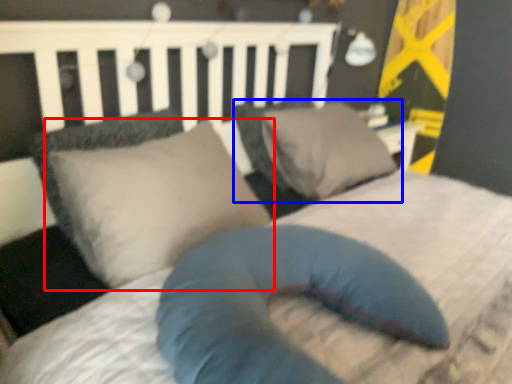
Question: Which of the following is the closest to the observer, pillow (highlighted by a red box) or pillow (highlighted by a blue box)?

Choices:
 (A) pillow
 (B) pillow

Answer: (A)